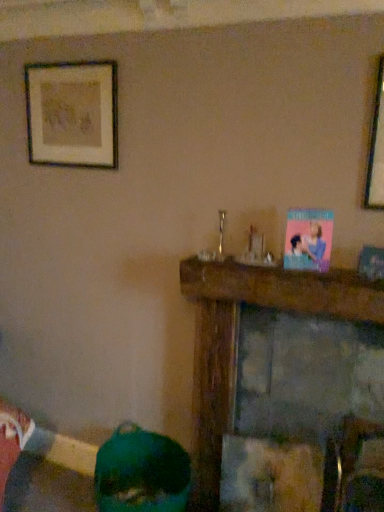
This screenshot has height=512, width=384. In order to click on green matte vase at lower left in this screenshot , I will do [x=141, y=472].

Where is `wooden mantel at center`? This screenshot has width=384, height=512. wooden mantel at center is located at coordinates (232, 332).

How distant is wooden framed artwork at upper left from green matte vase at lower left?

wooden framed artwork at upper left is 1.43 meters away from green matte vase at lower left.

Is wooden framed artwork at upper left facing away from green matte vase at lower left?

That's not correct — wooden framed artwork at upper left is not looking away from green matte vase at lower left.

From the picture: Considering the sizes of wooden framed artwork at upper left and green matte vase at lower left in the image, is wooden framed artwork at upper left bigger or smaller than green matte vase at lower left?

In the image, wooden framed artwork at upper left appears to be smaller than green matte vase at lower left.

From the image's perspective, which is above, wooden framed artwork at upper left or green matte vase at lower left?

From the image's view, wooden framed artwork at upper left is above.

From the image's perspective, which object appears higher, wooden mantel at center or wooden framed artwork at upper left?

wooden framed artwork at upper left.

Is wooden framed artwork at upper left inside wooden mantel at center?

No, wooden framed artwork at upper left is not inside wooden mantel at center.

From a real-world perspective, is wooden mantel at center positioned under wooden framed artwork at upper left based on gravity?

Yes.

How different are the orientations of wooden mantel at center and wooden framed artwork at upper left in degrees?

0.000751 degrees.

Is wooden mantel at center not close to green matte vase at lower left?

No, wooden mantel at center is not far from green matte vase at lower left.

Considering the sizes of objects wooden mantel at center and green matte vase at lower left in the image provided, who is shorter, wooden mantel at center or green matte vase at lower left?

green matte vase at lower left is shorter.

How different are the orientations of wooden mantel at center and green matte vase at lower left in degrees?

The angular difference between wooden mantel at center and green matte vase at lower left is 1.33 degrees.

Is wooden mantel at center thinner than green matte vase at lower left?

Correct, the width of wooden mantel at center is less than that of green matte vase at lower left.

Which is in front, green matte vase at lower left or wooden framed artwork at upper left?

green matte vase at lower left is in front.

Between point (184, 498) and point (115, 87), which one is positioned behind?

The point (184, 498) is behind.

Find the location of `person on the right of the wooden framed artwork at upper left`. person on the right of the wooden framed artwork at upper left is located at coordinates (141, 472).

Which is in front, point (142, 483) or point (314, 298)?

Point (314, 298)

Considering the relative positions of green matte vase at lower left and wooden mantel at center in the image provided, is green matte vase at lower left to the left or to the right of wooden mantel at center?

green matte vase at lower left is positioned on wooden mantel at center's left side.

How different are the orientations of green matte vase at lower left and wooden mantel at center in degrees?

1.33 degrees separate the facing orientations of green matte vase at lower left and wooden mantel at center.

Does green matte vase at lower left turn towards wooden mantel at center?

No, green matte vase at lower left does not turn towards wooden mantel at center.

Does point (80, 80) appear closer or farther from the camera than point (225, 297)?

Point (80, 80) appears to be farther away from the viewer than point (225, 297).

Considering the sizes of wooden framed artwork at upper left and wooden mantel at center in the image, is wooden framed artwork at upper left taller or shorter than wooden mantel at center?

Clearly, wooden framed artwork at upper left is shorter compared to wooden mantel at center.

Between wooden framed artwork at upper left and wooden mantel at center, which one appears on the right side from the viewer's perspective?

From the viewer's perspective, wooden mantel at center appears more on the right side.

Is wooden framed artwork at upper left bigger than wooden mantel at center?

Incorrect, wooden framed artwork at upper left is not larger than wooden mantel at center.

At what (x,y) coordinates should I click in order to perform the action: click on person directly beneath the wooden framed artwork at upper left (from a real-world perspective). Please return your answer as a coordinate pair (x, y). The height and width of the screenshot is (512, 384). Looking at the image, I should click on (141, 472).

Where is `picture frame on the left of wooden mantel at center`? This screenshot has width=384, height=512. picture frame on the left of wooden mantel at center is located at coordinates (72, 114).

From the image, which object appears to be nearer to wooden framed artwork at upper left, wooden mantel at center or green matte vase at lower left?

Based on the image, wooden mantel at center appears to be nearer to wooden framed artwork at upper left.

Which object lies further to the anchor point wooden mantel at center, wooden framed artwork at upper left or green matte vase at lower left?

Among the two, wooden framed artwork at upper left is located further to wooden mantel at center.

Which object lies nearer to the anchor point green matte vase at lower left, wooden framed artwork at upper left or wooden mantel at center?

wooden mantel at center.

Estimate the real-world distances between objects in this image. Which object is closer to wooden mantel at center, green matte vase at lower left or wooden framed artwork at upper left?

Based on the image, green matte vase at lower left appears to be nearer to wooden mantel at center.

Looking at the image, which one is located closer to green matte vase at lower left, wooden mantel at center or wooden framed artwork at upper left?

wooden mantel at center is closer to green matte vase at lower left.

Considering their positions, is green matte vase at lower left positioned further to wooden framed artwork at upper left than wooden mantel at center?

The object further to wooden framed artwork at upper left is green matte vase at lower left.

This screenshot has height=512, width=384. Find the location of `furniture between wooden framed artwork at upper left and green matte vase at lower left in the vertical direction`. furniture between wooden framed artwork at upper left and green matte vase at lower left in the vertical direction is located at coordinates (232, 332).